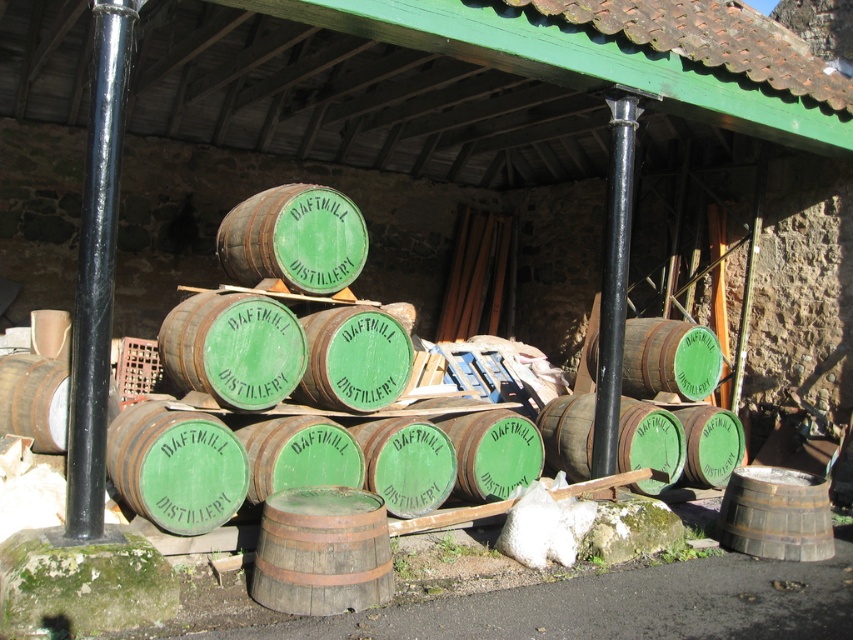
You are standing in the distillery area and need to locate two specific points marked in the image. Which of the two points, point (79, 358) or point (329, 595), is closer to you?

Point (79, 358) is closer to the viewer than point (329, 595).

You are a delivery person who needs to place a new wooden barrel that is 3 feet wide in the space between the black metal pole at left and the rustic wooden barrel at center. Is there enough space?

The distance between the black metal pole at left and the rustic wooden barrel at center is 4.27 feet, which is wider than the new wooden barrel that is 3 feet wide. Therefore, there is enough space to place the new wooden barrel between them.

You are standing at the point labeled point at [303,570]. You need to reach the door located at the opposite end of the structure. The path is 4.57 meters long. If your walking speed is 1.5 meters per second, how many seconds will it take you to reach the door?

The path between the point at [303,570] and the door is 4.57 meters. At a walking speed of 1.5 meters per second, it will take approximately 3.05 seconds to reach the door.